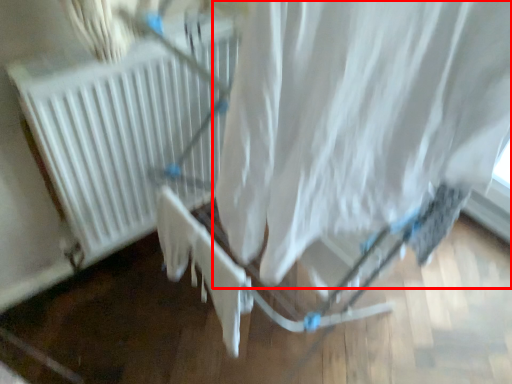
Question: From the image's perspective, where is curtain (annotated by the red box) located relative to heater?

Choices:
 (A) above
 (B) below

Answer: (B)